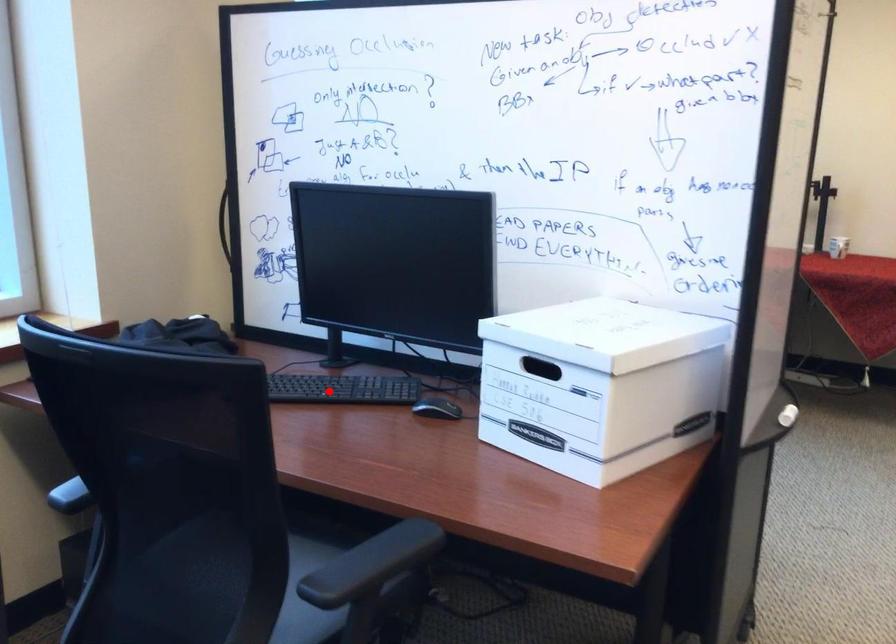
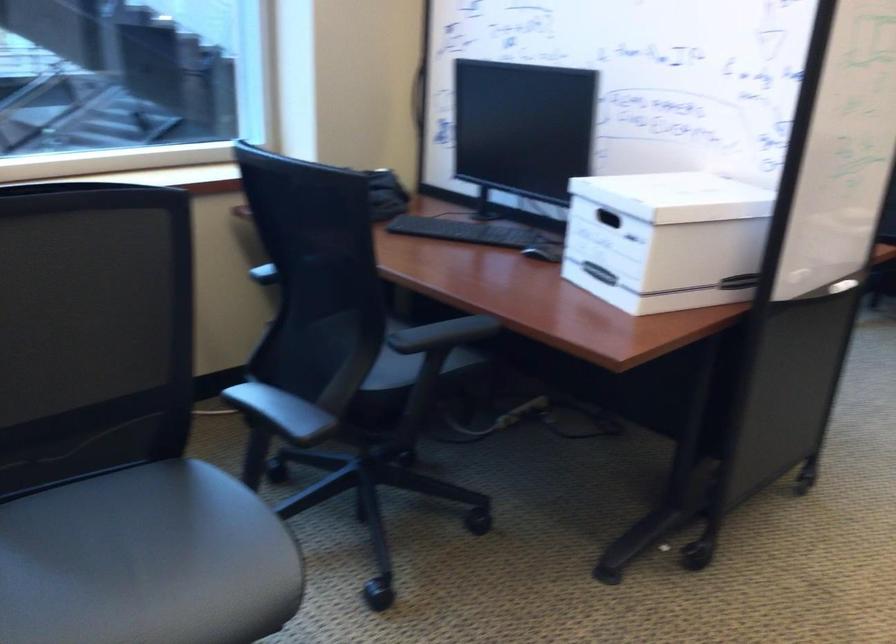
Question: A red point is marked in image1. In image2, is the corresponding 3D point closer to the camera or farther? Reply with the corresponding letter.

Choices:
 (A) The corresponding 3D point is closer.
 (B) The corresponding 3D point is farther.

Answer: (B)